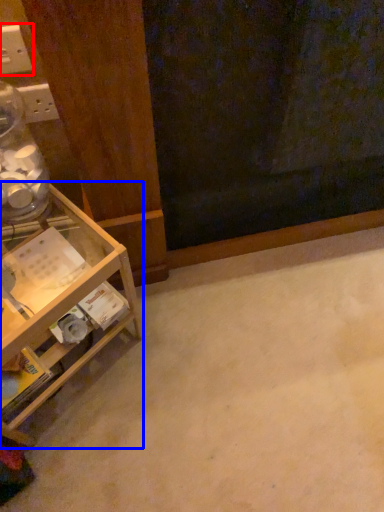
Question: Which object appears farthest to the camera in this image, electric outlet (highlighted by a red box) or shelf (highlighted by a blue box)?

Choices:
 (A) electric outlet
 (B) shelf

Answer: (A)